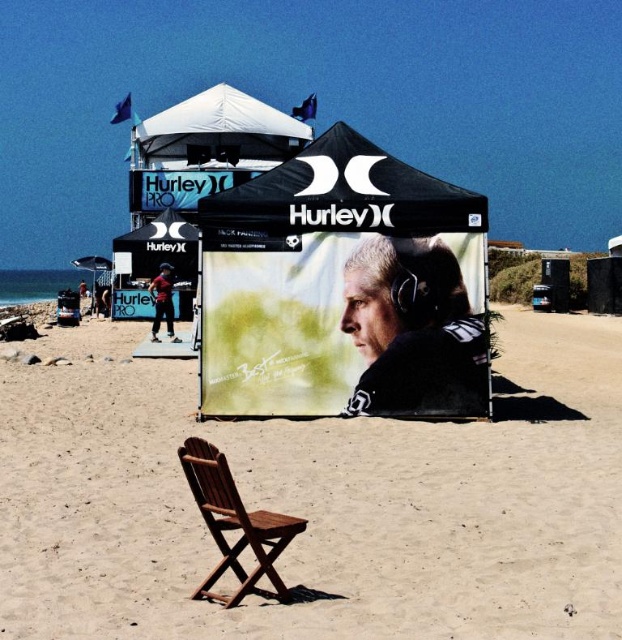
You are setting up a photography backdrop for a product shoot. You have two options for the background material. The black matte tent at center and the white fabric canopy at upper center. Which one would you choose if you want a material that is narrower in width?

The black matte tent at center is thinner than the white fabric canopy at upper center, so you should choose the black matte tent at center for a narrower width.

You are a beachgoer who wants to place a 2.5 meter long surfboard between the smooth sand at center and the wooden chair at center. Is there enough space to place it without moving either object?

The smooth sand at center is 2.26 meters away from the wooden chair at center. Since the surfboard is 2.5 meters long, it is longer than the available space between them, so it won not fit without moving either object.